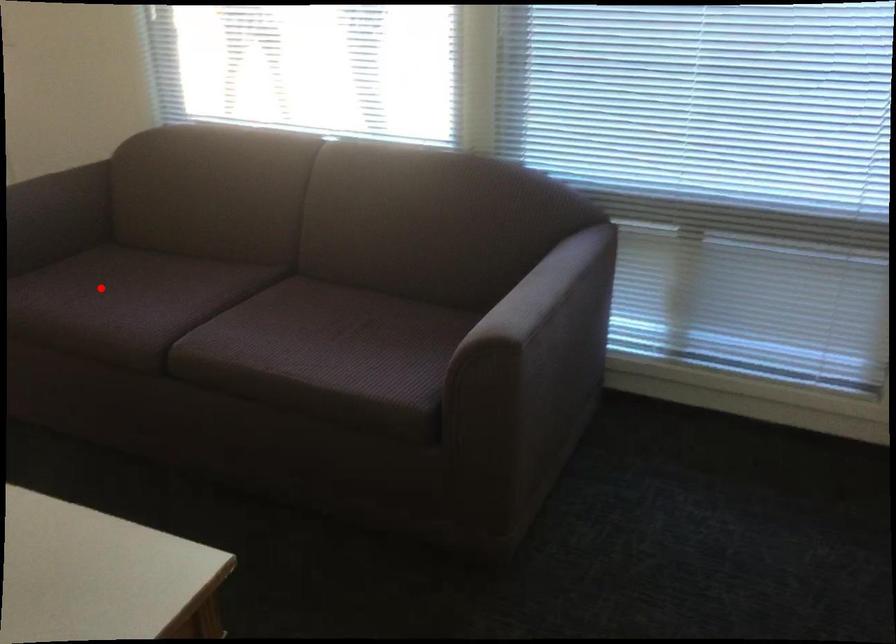
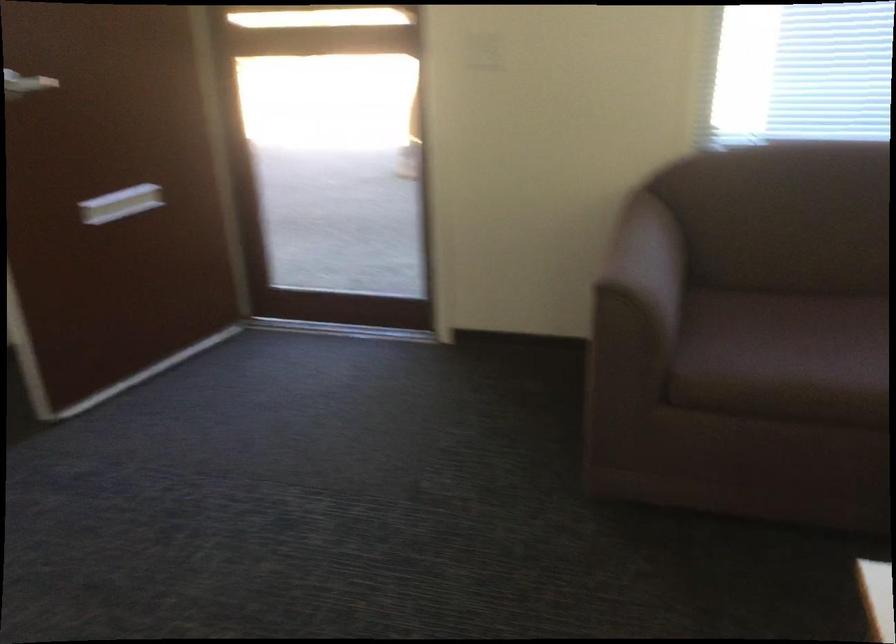
Question: A red point is marked in image1. In image2, is the corresponding 3D point closer to the camera or farther? Reply with the corresponding letter.

Choices:
 (A) The corresponding 3D point is closer.
 (B) The corresponding 3D point is farther.

Answer: (A)